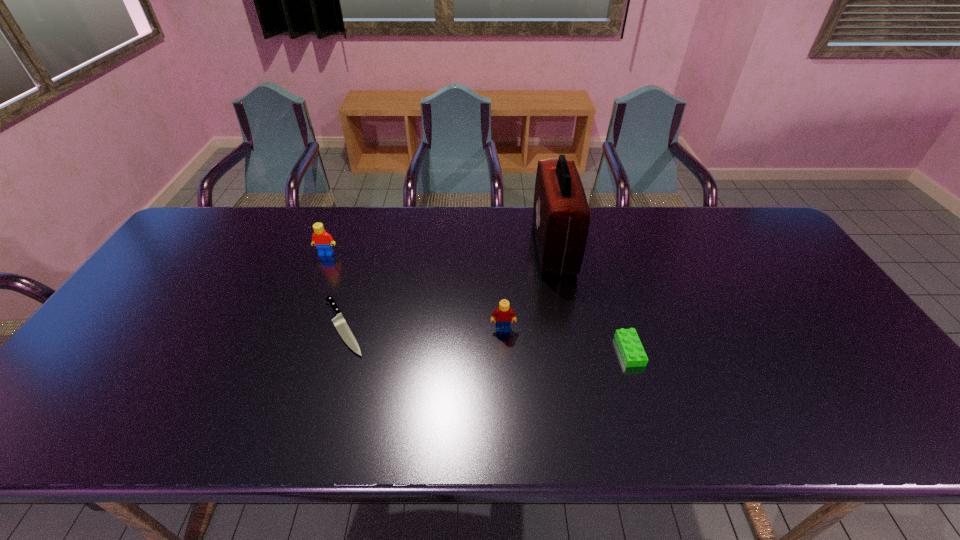
Image resolution: width=960 pixels, height=540 pixels. I want to click on vacant space located on the side of the fourth object from left to right with the cross symbol, so click(x=491, y=246).

I want to click on vacant space located on the side of the fourth object from left to right with the cross symbol, so click(x=481, y=246).

Locate an element on the screen. vacant space located on the side of the fourth object from left to right with the cross symbol is located at coordinates (449, 246).

Locate an element on the screen. vacant space positioned on the face of the leftmost Lego is located at coordinates (288, 350).

Image resolution: width=960 pixels, height=540 pixels. What are the coordinates of `vacant region located 0.210m on the front-facing side of the third object from right to left` in the screenshot? It's located at (507, 405).

What are the coordinates of `vacant region located on the left of the rightmost Lego` in the screenshot? It's located at (494, 350).

Image resolution: width=960 pixels, height=540 pixels. In order to click on vacant point located 0.370m on the left of the steak knife in this screenshot , I will do `click(177, 326)`.

What are the coordinates of `object present at the far edge` in the screenshot? It's located at (561, 215).

Locate an element on the screen. The image size is (960, 540). free space at the far edge of the desktop is located at coordinates (649, 244).

Image resolution: width=960 pixels, height=540 pixels. Find the location of `vacant space at the near edge`. vacant space at the near edge is located at coordinates (487, 442).